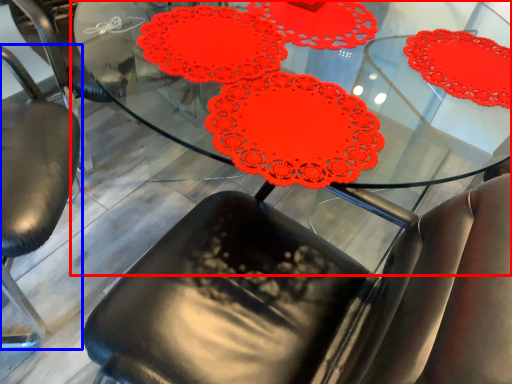
Question: Which point is closer to the camera, table (highlighted by a red box) or chair (highlighted by a blue box)?

Choices:
 (A) table
 (B) chair

Answer: (A)